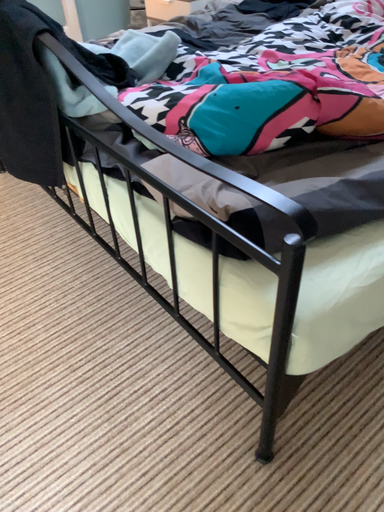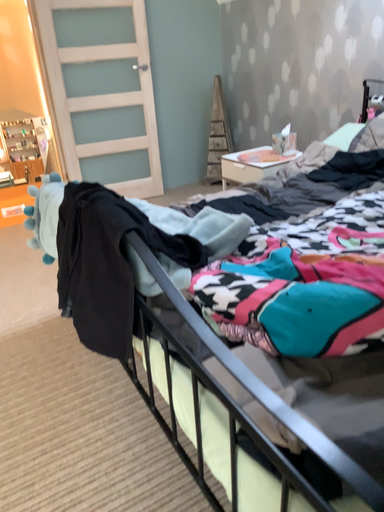
Question: How did the camera likely rotate when shooting the video?

Choices:
 (A) rotated downward
 (B) rotated upward

Answer: (B)